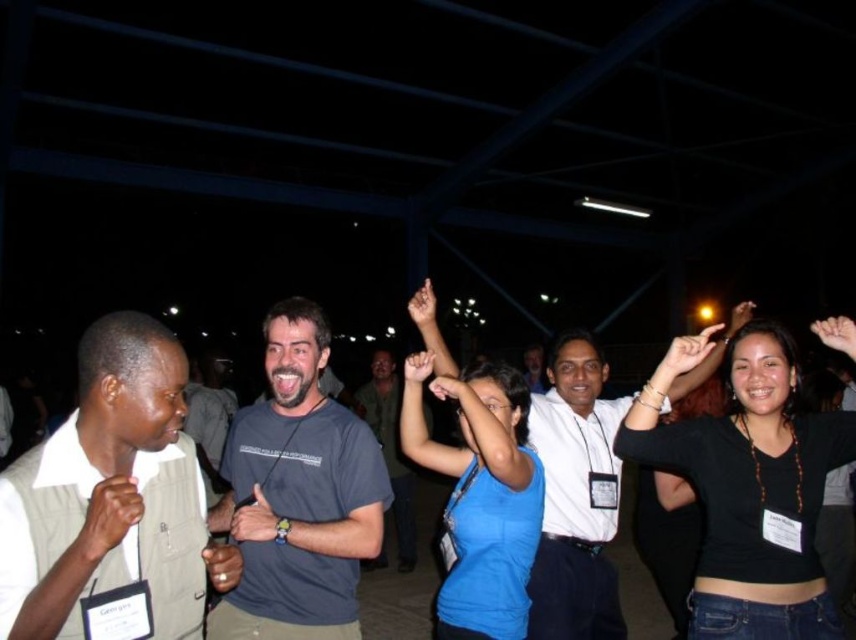
Which is behind, point (363, 396) or point (415, 300)?

The point (363, 396) is more distant.

At what (x,y) coordinates should I click in order to perform the action: click on dark gray t-shirt at center. Please return your answer as a coordinate pair (x, y). Looking at the image, I should click on pos(390,449).

Is gray cotton t-shirt at center further to the viewer compared to matte black hand at center?

No.

Based on the photo, how far apart are gray cotton t-shirt at center and matte black hand at center?

59.03 centimeters

Where is `gray cotton t-shirt at center`? The width and height of the screenshot is (856, 640). gray cotton t-shirt at center is located at coordinates (299, 493).

Does matte black hand at upper right appear on the right side of matte black hand at upper center?

Yes, matte black hand at upper right is to the right of matte black hand at upper center.

Who is higher up, matte black hand at upper right or matte black hand at upper center?

Positioned higher is matte black hand at upper center.

Which is in front, point (702, 362) or point (429, 296)?

Point (429, 296) is more forward.

I want to click on matte black hand at upper right, so click(691, 355).